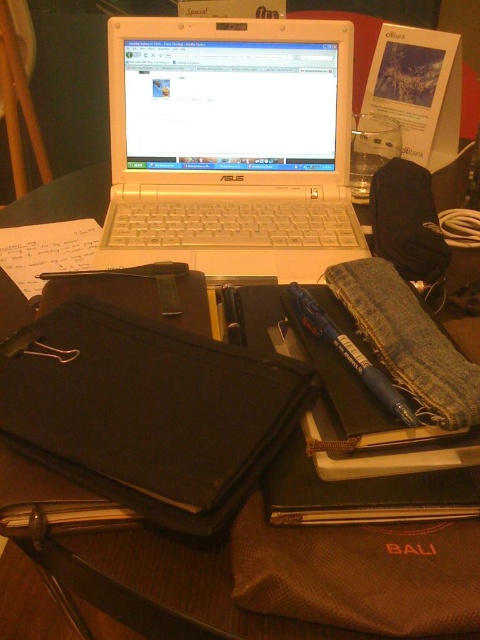
Question: Can you confirm if white plastic laptop at center is positioned to the right of black fabric binder at lower left?

Choices:
 (A) yes
 (B) no

Answer: (A)

Question: Which point is farther to the camera?

Choices:
 (A) (316, 236)
 (B) (319, 356)

Answer: (A)

Question: Estimate the real-world distances between objects in this image. Which object is closer to the white plastic laptop at center?

Choices:
 (A) black fabric binder at lower left
 (B) metallic blue pen at center-right

Answer: (B)

Question: Among these objects, which one is nearest to the camera?

Choices:
 (A) black fabric binder at lower left
 (B) white plastic laptop at center
 (C) metallic blue pen at center-right

Answer: (A)

Question: Is the position of white plastic laptop at center less distant than that of black fabric binder at lower left?

Choices:
 (A) yes
 (B) no

Answer: (B)

Question: In this image, where is white plastic laptop at center located relative to metallic blue pen at center-right?

Choices:
 (A) below
 (B) above

Answer: (B)